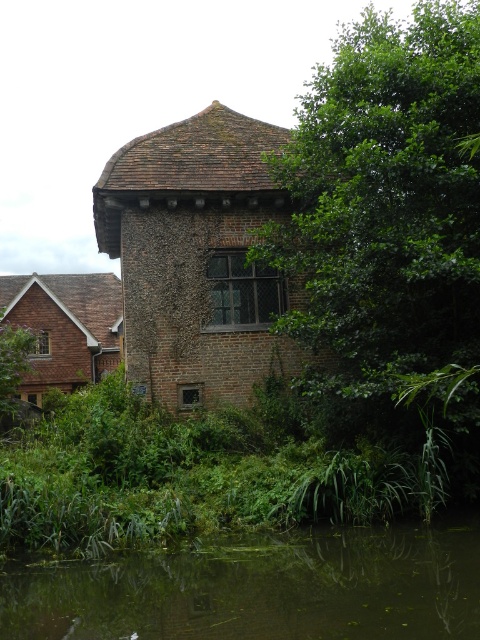
Question: Which object is farther from the camera taking this photo?

Choices:
 (A) green mossy water at lower center
 (B) green leafy tree at center

Answer: (B)

Question: Does green leafy tree at center appear over green mossy water at lower center?

Choices:
 (A) yes
 (B) no

Answer: (A)

Question: Can you confirm if green leafy tree at center is positioned to the left of green mossy water at lower center?

Choices:
 (A) yes
 (B) no

Answer: (B)

Question: Which point is farther to the camera?

Choices:
 (A) green leafy tree at center
 (B) green mossy water at lower center

Answer: (A)

Question: Which of the following is the farthest from the observer?

Choices:
 (A) (456, 209)
 (B) (396, 544)

Answer: (A)

Question: Can you confirm if green leafy tree at center is wider than green mossy water at lower center?

Choices:
 (A) no
 (B) yes

Answer: (B)